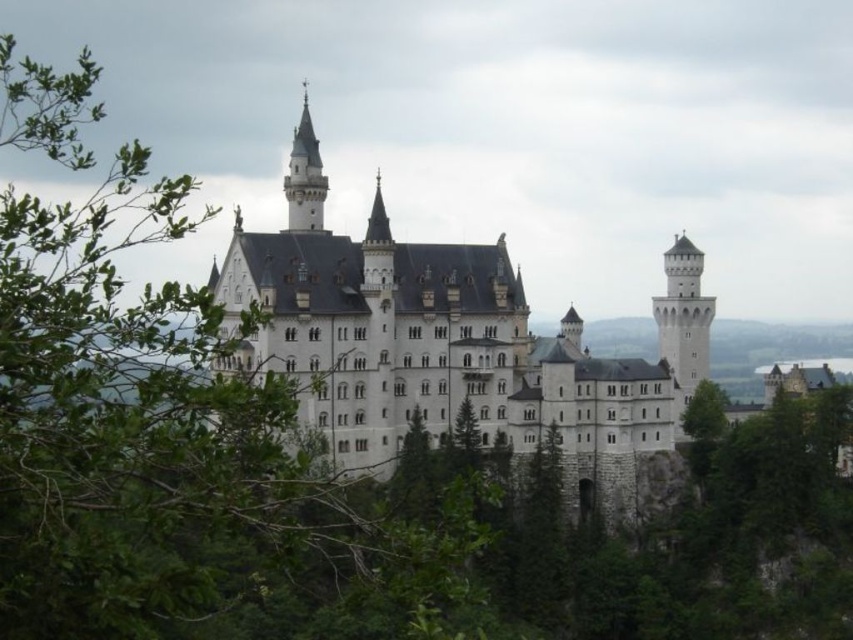
You are a visitor standing at the base of the castle grounds. You notice the white stone castle at center and the white stone tower at right. Which one appears closer to you from your current viewpoint?

→ The white stone castle at center appears closer because it is positioned in front of the white stone tower at right.

You are standing in the castle courtyard and want to take a photo of both the white stone tower at right and the white stone tower at upper center. Which tower should you position to your left to capture both in the frame?

You should position the white stone tower at upper center to your left because the white stone tower at right is already to the right of it, allowing both to be captured in the frame when aligned properly.